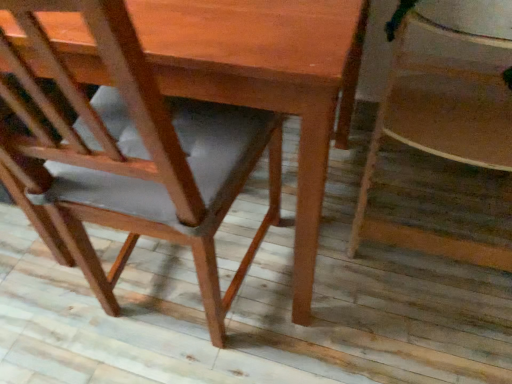
This screenshot has height=384, width=512. What do you see at coordinates (445, 110) in the screenshot?
I see `wooden chair at lower right, the second chair from the left` at bounding box center [445, 110].

You are a GUI agent. You are given a task and a screenshot of the screen. Output one action in this format:
    pyautogui.click(x=<x>, y=<y>)
    Task: Click on the wooden chair at lower right, which is the 1th chair from right to left
    
    Given the screenshot: What is the action you would take?
    pyautogui.click(x=445, y=110)

What do you see at coordinates (132, 157) in the screenshot? I see `matte brown chair at center, positioned as the 2th chair in right-to-left order` at bounding box center [132, 157].

How much space does matte brown chair at center, positioned as the 2th chair in right-to-left order, occupy horizontally?

matte brown chair at center, positioned as the 2th chair in right-to-left order, is 19.17 inches in width.

The image size is (512, 384). Find the location of `matte brown chair at center, the 1th chair when ordered from left to right`. matte brown chair at center, the 1th chair when ordered from left to right is located at coordinates (132, 157).

At what (x,y) coordinates should I click in order to perform the action: click on wooden chair at lower right, the second chair from the left. Please return your answer as a coordinate pair (x, y). Image resolution: width=512 pixels, height=384 pixels. Looking at the image, I should click on (445, 110).

Can you confirm if matte brown chair at center, positioned as the 2th chair in right-to-left order, is positioned to the right of wooden chair at lower right, the second chair from the left?

Incorrect, matte brown chair at center, positioned as the 2th chair in right-to-left order, is not on the right side of wooden chair at lower right, the second chair from the left.

Is matte brown chair at center, the 1th chair when ordered from left to right, in front of or behind wooden chair at lower right, which is the 1th chair from right to left, in the image?

Visually, matte brown chair at center, the 1th chair when ordered from left to right, is located in front of wooden chair at lower right, which is the 1th chair from right to left.

Considering the points (94, 117) and (484, 58), which point is behind, point (94, 117) or point (484, 58)?

The point (484, 58) is behind.

From the image's perspective, relative to wooden chair at lower right, the second chair from the left, is matte brown chair at center, the 1th chair when ordered from left to right, above or below?

Based on their image positions, matte brown chair at center, the 1th chair when ordered from left to right, is located beneath wooden chair at lower right, the second chair from the left.

From a real-world perspective, which object stands above the other?

matte brown chair at center, the 1th chair when ordered from left to right.

Is matte brown chair at center, the 1th chair when ordered from left to right, thinner than wooden chair at lower right, which is the 1th chair from right to left?

No, matte brown chair at center, the 1th chair when ordered from left to right, is not thinner than wooden chair at lower right, which is the 1th chair from right to left.

Does matte brown chair at center, positioned as the 2th chair in right-to-left order, have a greater height compared to wooden chair at lower right, which is the 1th chair from right to left?

Yes.

Between matte brown chair at center, the 1th chair when ordered from left to right, and wooden chair at lower right, the second chair from the left, which one has larger size?

With larger size is matte brown chair at center, the 1th chair when ordered from left to right.

Is matte brown chair at center, positioned as the 2th chair in right-to-left order, completely or partially outside of wooden chair at lower right, the second chair from the left?

Yes, matte brown chair at center, positioned as the 2th chair in right-to-left order, is located beyond the bounds of wooden chair at lower right, the second chair from the left.

Is matte brown chair at center, positioned as the 2th chair in right-to-left order, not close to wooden chair at lower right, which is the 1th chair from right to left?

No, matte brown chair at center, positioned as the 2th chair in right-to-left order, is not far away from wooden chair at lower right, which is the 1th chair from right to left.

Is matte brown chair at center, the 1th chair when ordered from left to right, looking in the opposite direction of wooden chair at lower right, which is the 1th chair from right to left?

No, wooden chair at lower right, which is the 1th chair from right to left, is not at the back of matte brown chair at center, the 1th chair when ordered from left to right.

What are the coordinates of `chair lying below the wooden chair at lower right, the second chair from the left (from the image's perspective)` in the screenshot? It's located at (132, 157).

Considering the relative positions of wooden chair at lower right, the second chair from the left, and matte brown chair at center, positioned as the 2th chair in right-to-left order, in the image provided, is wooden chair at lower right, the second chair from the left, to the right of matte brown chair at center, positioned as the 2th chair in right-to-left order, from the viewer's perspective?

Correct, you'll find wooden chair at lower right, the second chair from the left, to the right of matte brown chair at center, positioned as the 2th chair in right-to-left order.

Looking at this image, which object is further away from the camera, wooden chair at lower right, the second chair from the left, or matte brown chair at center, positioned as the 2th chair in right-to-left order?

wooden chair at lower right, the second chair from the left, is more distant.

Considering the points (371, 179) and (37, 150), which point is in front, point (371, 179) or point (37, 150)?

The point (37, 150) is more forward.

In the scene shown: From the image's perspective, between wooden chair at lower right, which is the 1th chair from right to left, and matte brown chair at center, positioned as the 2th chair in right-to-left order, which one is located above?

wooden chair at lower right, which is the 1th chair from right to left, from the image's perspective.

From a real-world perspective, is wooden chair at lower right, which is the 1th chair from right to left, beneath matte brown chair at center, the 1th chair when ordered from left to right?

Correct, in the physical world, wooden chair at lower right, which is the 1th chair from right to left, is lower than matte brown chair at center, the 1th chair when ordered from left to right.

Which of these two, wooden chair at lower right, the second chair from the left, or matte brown chair at center, the 1th chair when ordered from left to right, is thinner?

wooden chair at lower right, the second chair from the left, is thinner.

Does wooden chair at lower right, which is the 1th chair from right to left, have a lesser height compared to matte brown chair at center, positioned as the 2th chair in right-to-left order?

Correct, wooden chair at lower right, which is the 1th chair from right to left, is not as tall as matte brown chair at center, positioned as the 2th chair in right-to-left order.

Considering the relative sizes of wooden chair at lower right, which is the 1th chair from right to left, and matte brown chair at center, the 1th chair when ordered from left to right, in the image provided, is wooden chair at lower right, which is the 1th chair from right to left, bigger than matte brown chair at center, the 1th chair when ordered from left to right,?

No.

Does wooden chair at lower right, which is the 1th chair from right to left, contain matte brown chair at center, the 1th chair when ordered from left to right?

No, matte brown chair at center, the 1th chair when ordered from left to right, is not surrounded by wooden chair at lower right, which is the 1th chair from right to left.

Consider the image. Is wooden chair at lower right, the second chair from the left, positioned far away from matte brown chair at center, the 1th chair when ordered from left to right?

wooden chair at lower right, the second chair from the left, is near matte brown chair at center, the 1th chair when ordered from left to right, not far away.

Is wooden chair at lower right, which is the 1th chair from right to left, facing towards matte brown chair at center, positioned as the 2th chair in right-to-left order?

No, wooden chair at lower right, which is the 1th chair from right to left, is not facing towards matte brown chair at center, positioned as the 2th chair in right-to-left order.

In the scene shown: How far apart are wooden chair at lower right, which is the 1th chair from right to left, and matte brown chair at center, the 1th chair when ordered from left to right?

wooden chair at lower right, which is the 1th chair from right to left, is 19.21 inches away from matte brown chair at center, the 1th chair when ordered from left to right.

Image resolution: width=512 pixels, height=384 pixels. What are the coordinates of `chair in front of the wooden chair at lower right, the second chair from the left` in the screenshot? It's located at (132, 157).

Identify the location of chair that is behind the matte brown chair at center, positioned as the 2th chair in right-to-left order. The width and height of the screenshot is (512, 384). (445, 110).

Where is `chair beneath the matte brown chair at center, positioned as the 2th chair in right-to-left order (from a real-world perspective)`? chair beneath the matte brown chair at center, positioned as the 2th chair in right-to-left order (from a real-world perspective) is located at coordinates (445, 110).